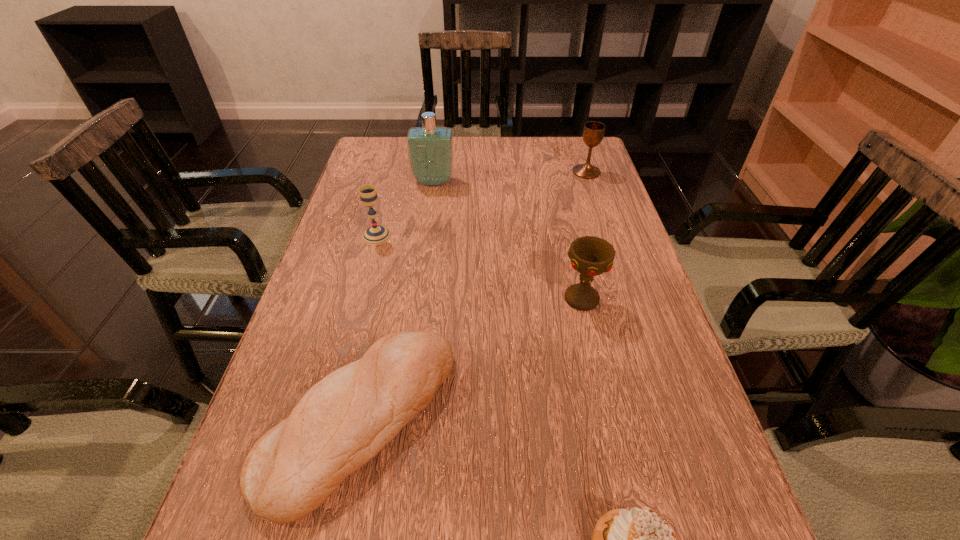
Find the location of `blank space located on the back of the nearest chalice`. blank space located on the back of the nearest chalice is located at coordinates (574, 262).

Find the location of a particular element. The width and height of the screenshot is (960, 540). vacant position located 0.160m on the right of the second farthest chalice is located at coordinates (455, 236).

You are a GUI agent. You are given a task and a screenshot of the screen. Output one action in this format:
    pyautogui.click(x=<x>, y=<y>)
    Task: Click on the vacant space positioned on the right of the bread
    Image resolution: width=960 pixels, height=540 pixels.
    Given the screenshot: What is the action you would take?
    pyautogui.click(x=659, y=419)

This screenshot has height=540, width=960. I want to click on object that is positioned at the far edge, so click(593, 132).

I want to click on chalice that is at the left edge, so click(x=376, y=234).

Locate an element on the screen. The image size is (960, 540). bread that is at the left edge is located at coordinates (342, 422).

The image size is (960, 540). Find the location of `object located at the far right corner`. object located at the far right corner is located at coordinates (593, 132).

In order to click on free space at the far edge of the desktop in this screenshot , I will do `click(526, 146)`.

In the image, there is a desktop. At what (x,y) coordinates should I click in order to perform the action: click on free space at the left edge. Please return your answer as a coordinate pair (x, y). This screenshot has width=960, height=540. Looking at the image, I should click on (392, 212).

Find the location of `vacant space at the right edge of the desktop`. vacant space at the right edge of the desktop is located at coordinates (645, 414).